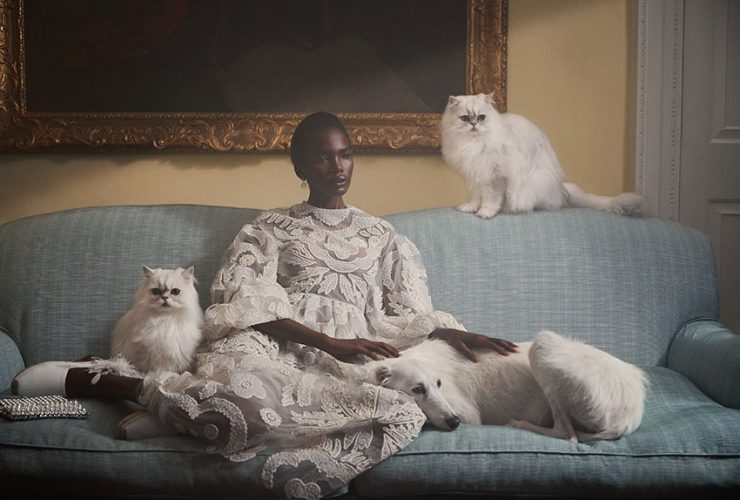
Where is `inner wall`? Image resolution: width=740 pixels, height=500 pixels. inner wall is located at coordinates (571, 89).